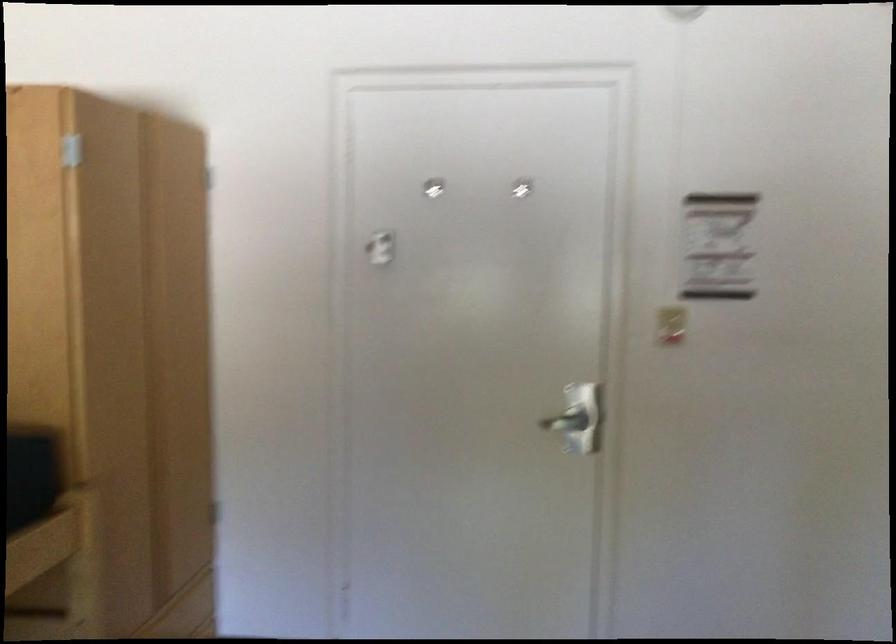
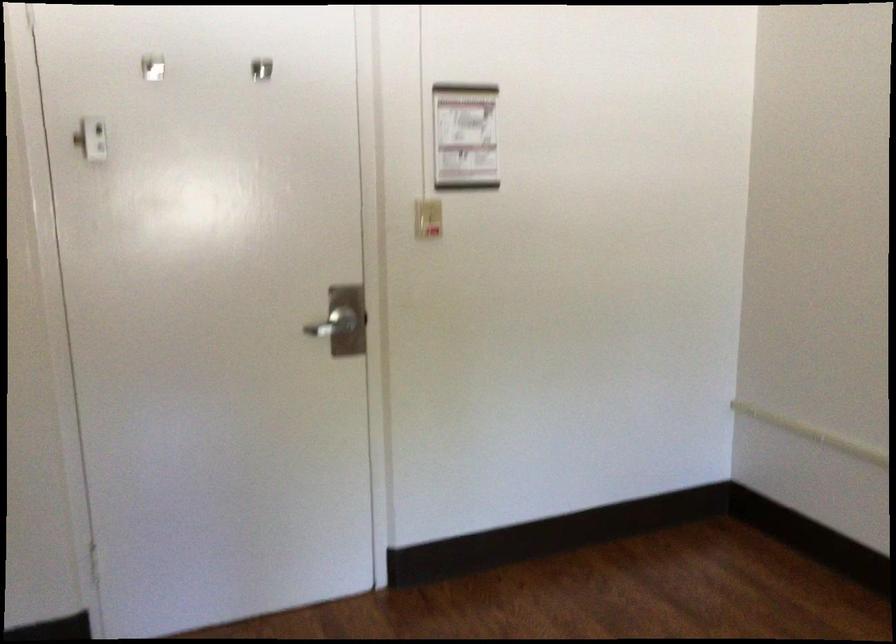
Where in the second image is the point corresponding to (x=563, y=419) from the first image?

(330, 323)